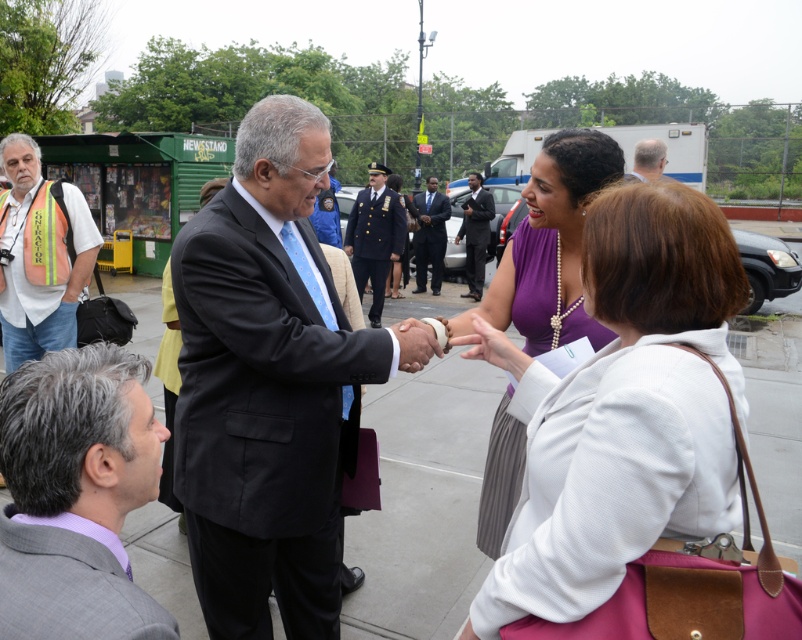
Is point (533, 170) less distant than point (35, 282)?

Yes, point (533, 170) is closer to viewer.

Is purple satin dress at center positioned behind orange reflective vest at left?

No, purple satin dress at center is in front of orange reflective vest at left.

This screenshot has width=802, height=640. Identify the location of purple satin dress at center. (553, 244).

Is orange reflective vest at left taller than gray hair at center?

Correct, orange reflective vest at left is much taller as gray hair at center.

The width and height of the screenshot is (802, 640). In order to click on orange reflective vest at left in this screenshot , I will do `click(39, 257)`.

Where is `orange reflective vest at left`? orange reflective vest at left is located at coordinates [x=39, y=257].

Identify the location of orange reflective vest at left. The width and height of the screenshot is (802, 640). (39, 257).

Between matte black suit at center and gray hair at center, which one has more height?

With more height is matte black suit at center.

Does point (333, 536) lie in front of point (643, 150)?

That is True.

You are a GUI agent. You are given a task and a screenshot of the screen. Output one action in this format:
    pyautogui.click(x=<x>, y=<y>)
    Task: Click on the matte black suit at center
    The width and height of the screenshot is (802, 640).
    Given the screenshot: What is the action you would take?
    point(269,385)